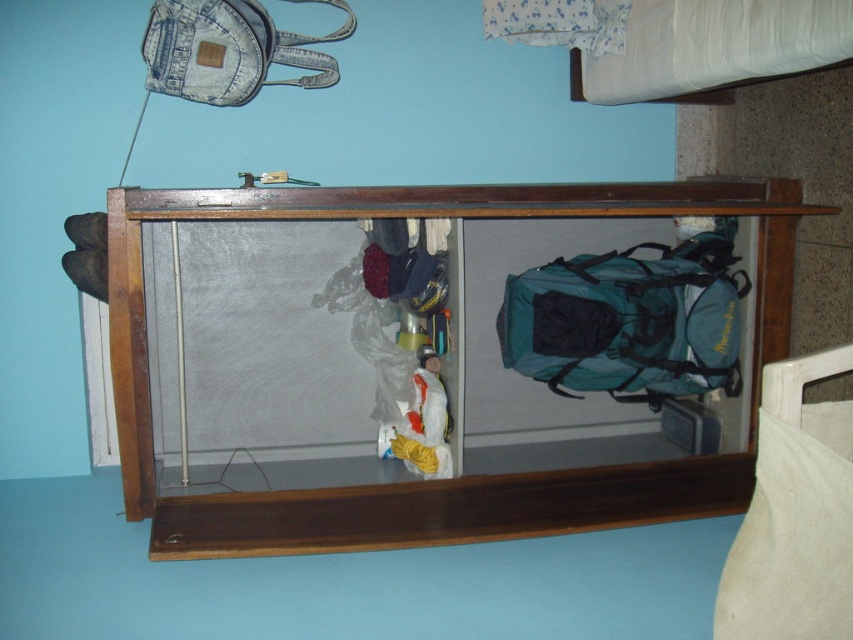
You are standing in the room shown in the image and want to place a small plant on the wooden shelf at center. Based on the scene description, where exactly is the wooden shelf located in relation to the mirror and the wall?

The wooden shelf at center is located at point coordinates (456, 477) in the scene. However, since the mirror is reflecting part of the room, the shelf is likely positioned near the wall where the mirror is leaning, possibly behind or adjacent to the mirror. To place the plant, you should look for the shelf in the central area near the light blue wall where the mirror is placed.

You are standing in front of the mirror and want to reach the point marked at coordinates point (x=816, y=552). If your arm can extend 1.2 meters, can you reach it?

The distance between point (x=816, y=552) and the camera is 1.23 meters. Since your arm can only extend 1.2 meters, you cannot reach it.